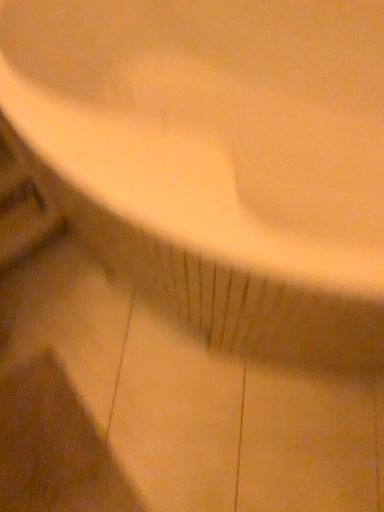
This screenshot has width=384, height=512. Describe the element at coordinates (215, 123) in the screenshot. I see `white glossy sink at upper center` at that location.

Locate an element on the screen. Image resolution: width=384 pixels, height=512 pixels. white glossy sink at upper center is located at coordinates (215, 123).

This screenshot has height=512, width=384. What are the coordinates of `white glossy sink at upper center` in the screenshot? It's located at (215, 123).